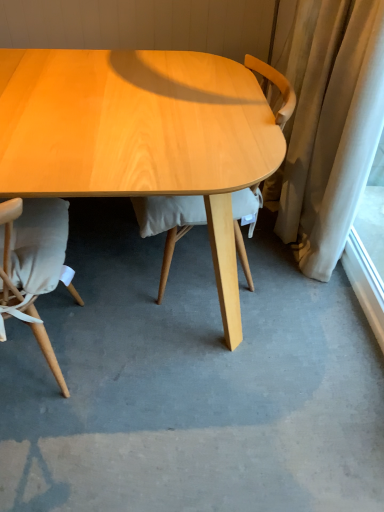
Where is `matte beige chair at lower left, the 1th chair in the left-to-right sequence`? matte beige chair at lower left, the 1th chair in the left-to-right sequence is located at coordinates (34, 267).

You are a GUI agent. You are given a task and a screenshot of the screen. Output one action in this format:
    pyautogui.click(x=<x>, y=<y>)
    Task: Click on the light wood chair at center, which is counted as the second chair, starting from the left
    
    Given the screenshot: What is the action you would take?
    pyautogui.click(x=168, y=223)

What do you see at coordinates (168, 223) in the screenshot?
I see `light wood chair at center, which is counted as the second chair, starting from the left` at bounding box center [168, 223].

Image resolution: width=384 pixels, height=512 pixels. I want to click on white sheer curtain at right, so click(x=368, y=259).

What's the angular difference between matte beige chair at lower left, the 2th chair when ordered from right to left, and white sheer curtain at right's facing directions?

The angle between the facing direction of matte beige chair at lower left, the 2th chair when ordered from right to left, and the facing direction of white sheer curtain at right is 89.3 degrees.

From the picture: Would you consider matte beige chair at lower left, the 1th chair in the left-to-right sequence, to be distant from white sheer curtain at right?

Absolutely, matte beige chair at lower left, the 1th chair in the left-to-right sequence, is distant from white sheer curtain at right.

From the image's perspective, is matte beige chair at lower left, the 1th chair in the left-to-right sequence, positioned above or below white sheer curtain at right?

Based on their image positions, matte beige chair at lower left, the 1th chair in the left-to-right sequence, is located beneath white sheer curtain at right.

In the scene shown: Is matte beige chair at lower left, the 1th chair in the left-to-right sequence, located outside white sheer curtain at right?

Yes, matte beige chair at lower left, the 1th chair in the left-to-right sequence, is not within white sheer curtain at right.

Is point (278, 79) farther from camera compared to point (11, 222)?

That is True.

Is matte beige chair at lower left, the 1th chair in the left-to-right sequence, surrounded by light wood chair at center, the 1th chair positioned from the right?

That's incorrect, matte beige chair at lower left, the 1th chair in the left-to-right sequence, is not inside light wood chair at center, the 1th chair positioned from the right.

Can you confirm if light wood chair at center, which is counted as the second chair, starting from the left, is taller than matte beige chair at lower left, the 2th chair when ordered from right to left?

Yes, light wood chair at center, which is counted as the second chair, starting from the left, is taller than matte beige chair at lower left, the 2th chair when ordered from right to left.

Image resolution: width=384 pixels, height=512 pixels. Identify the location of window screen behind the light wood chair at center, which is counted as the second chair, starting from the left. (368, 259).

Is white sheer curtain at right in front of or behind light wood chair at center, the 1th chair positioned from the right, in the image?

white sheer curtain at right is positioned farther from the viewer than light wood chair at center, the 1th chair positioned from the right.

Which is correct: white sheer curtain at right is inside light wood chair at center, which is counted as the second chair, starting from the left, or outside of it?

white sheer curtain at right is spatially situated outside light wood chair at center, which is counted as the second chair, starting from the left.

In the scene shown: Are white sheer curtain at right and light wood chair at center, which is counted as the second chair, starting from the left, beside each other?

They are not placed beside each other.

In terms of width, does light wood chair at center, which is counted as the second chair, starting from the left, look wider or thinner when compared to white sheer curtain at right?

In the image, light wood chair at center, which is counted as the second chair, starting from the left, appears to be wider than white sheer curtain at right.

From the image's perspective, does light wood chair at center, the 1th chair positioned from the right, appear lower than white sheer curtain at right?

Actually, light wood chair at center, the 1th chair positioned from the right, appears above white sheer curtain at right in the image.

From a real-world perspective, who is located higher, light wood chair at center, which is counted as the second chair, starting from the left, or white sheer curtain at right?

light wood chair at center, which is counted as the second chair, starting from the left, is physically above.

Is light wood chair at center, the 1th chair positioned from the right, bigger than white sheer curtain at right?

Yes, light wood chair at center, the 1th chair positioned from the right, is bigger than white sheer curtain at right.

Is matte beige chair at lower left, the 1th chair in the left-to-right sequence, surrounded by white sheer curtain at right?

Actually, matte beige chair at lower left, the 1th chair in the left-to-right sequence, is outside white sheer curtain at right.

Which is behind, point (375, 188) or point (10, 220)?

Positioned behind is point (375, 188).

From the white sheer curtain at right, count 2nd chairs forward and point to it. Please provide its 2D coordinates.

[(34, 267)]

Considering the relative positions of white sheer curtain at right and matte beige chair at lower left, the 2th chair when ordered from right to left, in the image provided, is white sheer curtain at right to the left or to the right of matte beige chair at lower left, the 2th chair when ordered from right to left,?

Clearly, white sheer curtain at right is on the right of matte beige chair at lower left, the 2th chair when ordered from right to left, in the image.

Consider the image. Is matte beige chair at lower left, the 2th chair when ordered from right to left, far away from light wood chair at center, which is counted as the second chair, starting from the left?

Actually, matte beige chair at lower left, the 2th chair when ordered from right to left, and light wood chair at center, which is counted as the second chair, starting from the left, are a little close together.

Considering the relative sizes of matte beige chair at lower left, the 2th chair when ordered from right to left, and light wood chair at center, the 1th chair positioned from the right, in the image provided, is matte beige chair at lower left, the 2th chair when ordered from right to left, wider than light wood chair at center, the 1th chair positioned from the right,?

Correct, the width of matte beige chair at lower left, the 2th chair when ordered from right to left, exceeds that of light wood chair at center, the 1th chair positioned from the right.

Choose the correct answer: Is matte beige chair at lower left, the 2th chair when ordered from right to left, inside light wood chair at center, which is counted as the second chair, starting from the left, or outside it?

matte beige chair at lower left, the 2th chair when ordered from right to left, is spatially situated outside light wood chair at center, which is counted as the second chair, starting from the left.

Find the location of a particular element. The width and height of the screenshot is (384, 512). the 2nd chair in front of the white sheer curtain at right is located at coordinates (34, 267).

Locate an element on the screen. The width and height of the screenshot is (384, 512). chair lying behind the matte beige chair at lower left, the 2th chair when ordered from right to left is located at coordinates (168, 223).

When comparing their distances from light wood chair at center, the 1th chair positioned from the right, does white sheer curtain at right or matte beige chair at lower left, the 1th chair in the left-to-right sequence, seem further?

white sheer curtain at right is further to light wood chair at center, the 1th chair positioned from the right.

Based on their spatial positions, is matte beige chair at lower left, the 1th chair in the left-to-right sequence, or white sheer curtain at right further from light wood chair at center, which is counted as the second chair, starting from the left?

white sheer curtain at right is positioned further to the anchor light wood chair at center, which is counted as the second chair, starting from the left.

Estimate the real-world distances between objects in this image. Which object is closer to white sheer curtain at right, matte beige chair at lower left, the 2th chair when ordered from right to left, or light wood chair at center, which is counted as the second chair, starting from the left?

light wood chair at center, which is counted as the second chair, starting from the left.

Which object lies further to the anchor point matte beige chair at lower left, the 1th chair in the left-to-right sequence, white sheer curtain at right or light wood chair at center, the 1th chair positioned from the right?

white sheer curtain at right.

Which object lies nearer to the anchor point white sheer curtain at right, light wood chair at center, which is counted as the second chair, starting from the left, or matte beige chair at lower left, the 2th chair when ordered from right to left?

light wood chair at center, which is counted as the second chair, starting from the left, lies closer to white sheer curtain at right than the other object.

Based on their spatial positions, is light wood chair at center, the 1th chair positioned from the right, or white sheer curtain at right further from matte beige chair at lower left, the 2th chair when ordered from right to left?

Among the two, white sheer curtain at right is located further to matte beige chair at lower left, the 2th chair when ordered from right to left.

This screenshot has height=512, width=384. I want to click on chair between matte beige chair at lower left, the 1th chair in the left-to-right sequence, and white sheer curtain at right, so click(168, 223).